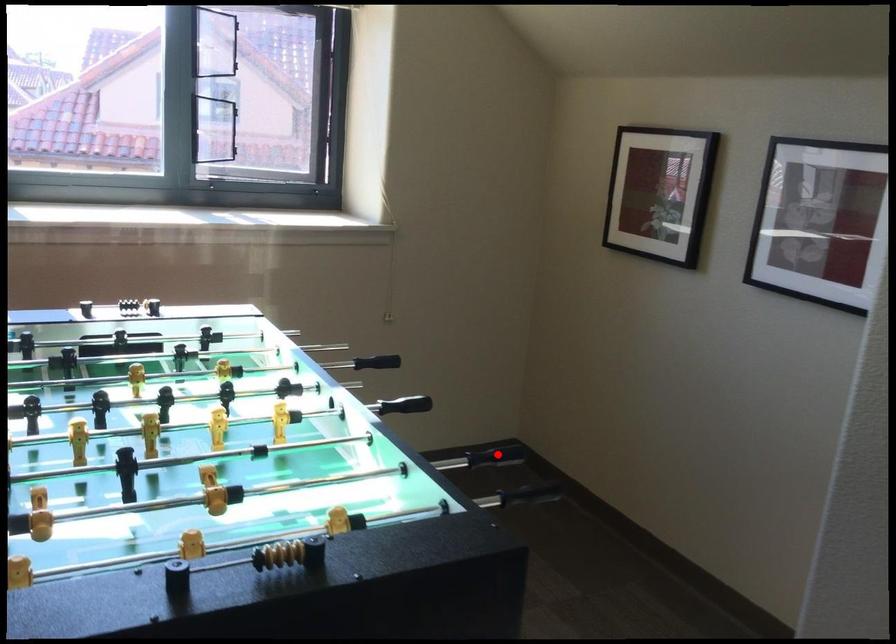
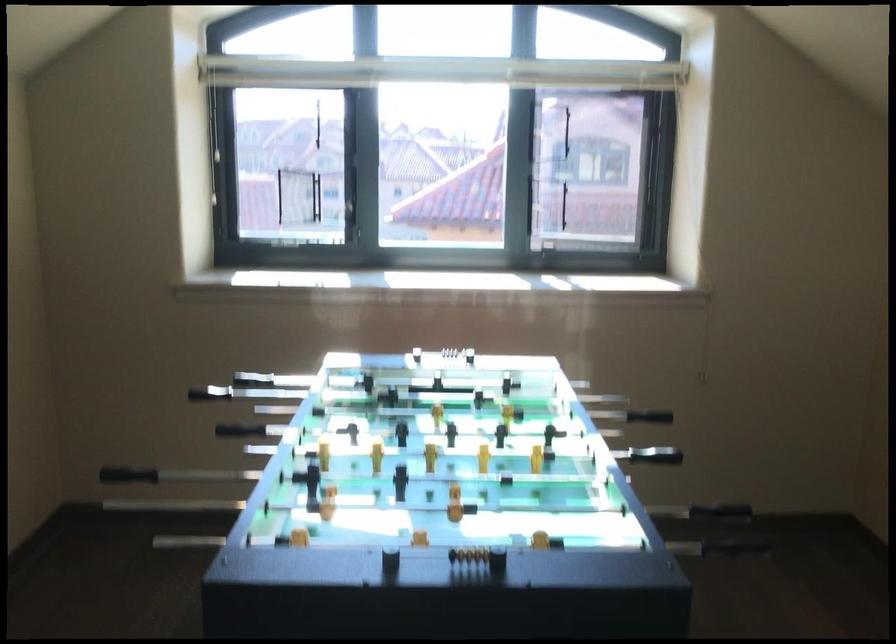
Question: I am providing you with two images of the same scene from different viewpoints. A red point is marked on the first image. At the location where the point appears in image 1, is it still visible in image 2?

Choices:
 (A) Yes
 (B) No

Answer: (A)